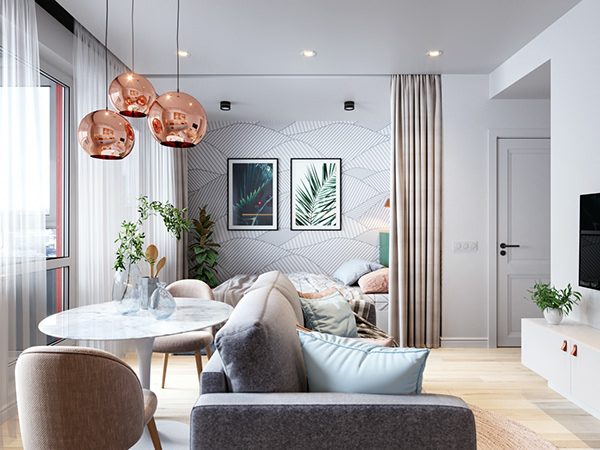
The height and width of the screenshot is (450, 600). Identify the location of bed. (377, 310).